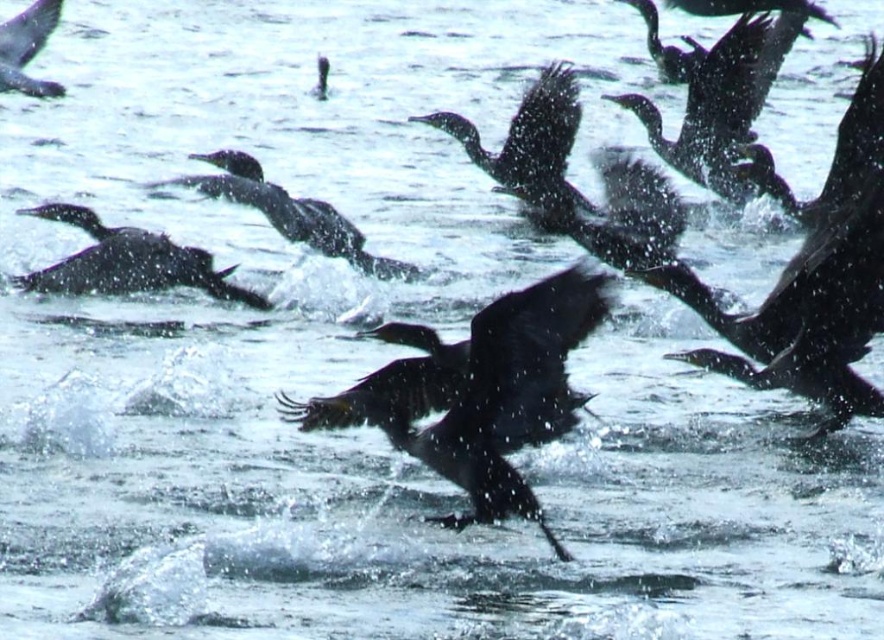
Is shiny black bird at left positioned at the back of shiny black bird at upper left?

No, it is not.

Is shiny black bird at left to the right of shiny black bird at upper left from the viewer's perspective?

Correct, you'll find shiny black bird at left to the right of shiny black bird at upper left.

The width and height of the screenshot is (884, 640). Describe the element at coordinates (128, 262) in the screenshot. I see `shiny black bird at left` at that location.

I want to click on shiny black bird at left, so click(x=128, y=262).

Does point (303, 416) come closer to viewer compared to point (105, 243)?

Yes, point (303, 416) is in front of point (105, 243).

The height and width of the screenshot is (640, 884). What do you see at coordinates (479, 394) in the screenshot? I see `shiny black bird at center` at bounding box center [479, 394].

Image resolution: width=884 pixels, height=640 pixels. What do you see at coordinates (479, 394) in the screenshot? I see `shiny black bird at center` at bounding box center [479, 394].

The width and height of the screenshot is (884, 640). Find the location of `shiny black bird at center`. shiny black bird at center is located at coordinates (479, 394).

Can you confirm if shiny black bird at center is smaller than shiny black bird at upper left?

No, shiny black bird at center is not smaller than shiny black bird at upper left.

Does point (522, 404) come behind point (43, 42)?

No, (522, 404) is in front of (43, 42).

Locate an element on the screen. shiny black bird at center is located at coordinates (x=479, y=394).